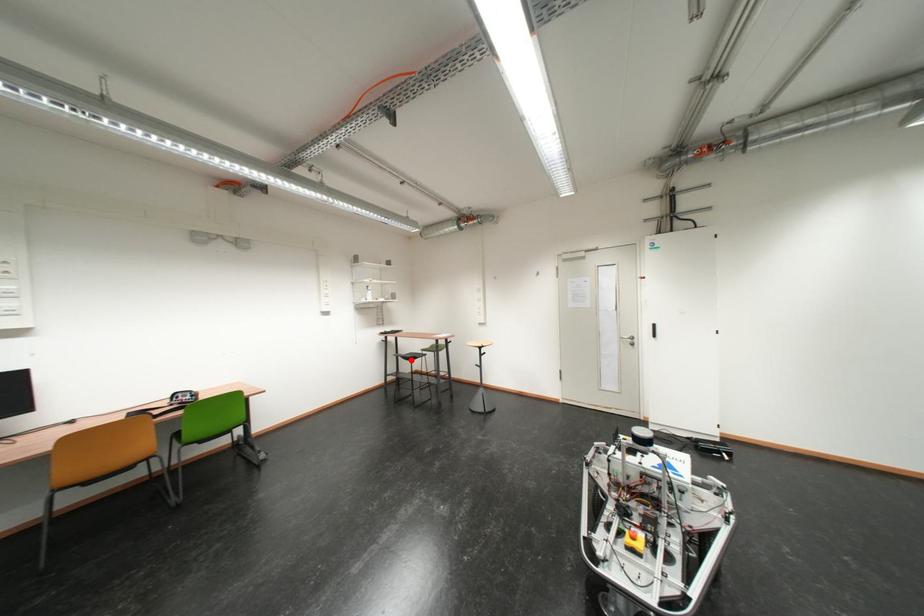
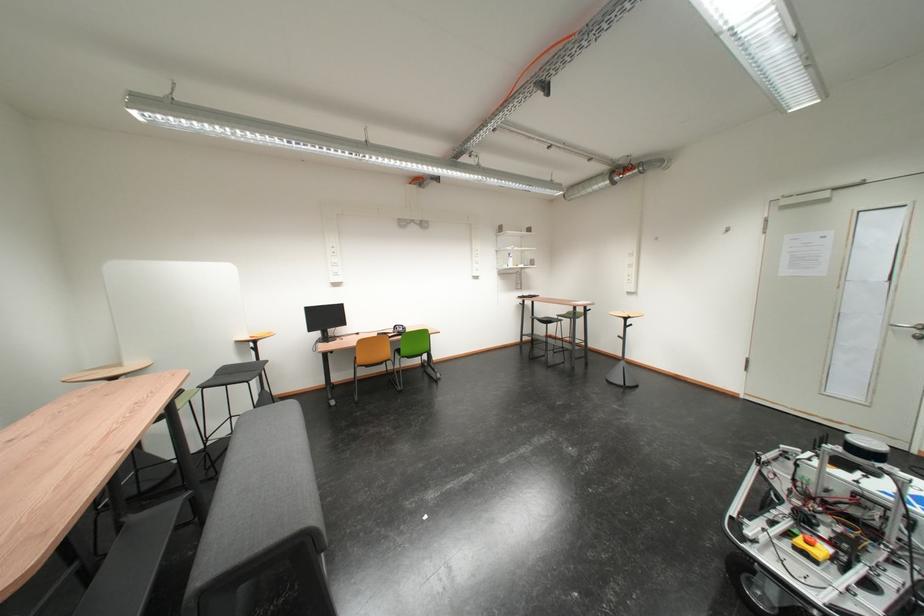
Where in the second image is the point corresponding to the highlighted location from the first image?

(546, 323)